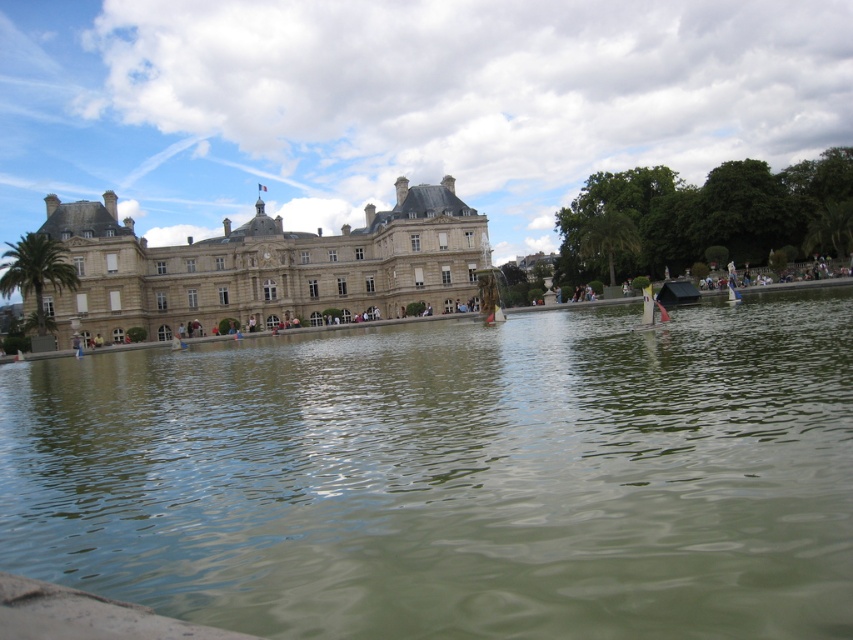
Question: Is greenish water at center further to the viewer compared to brown stone palace at center?

Choices:
 (A) yes
 (B) no

Answer: (B)

Question: Is greenish water at center to the left of brown stone palace at center from the viewer's perspective?

Choices:
 (A) yes
 (B) no

Answer: (B)

Question: Is greenish water at center bigger than brown stone palace at center?

Choices:
 (A) no
 (B) yes

Answer: (B)

Question: Which object appears farthest from the camera in this image?

Choices:
 (A) brown stone palace at center
 (B) greenish water at center

Answer: (A)

Question: Which object is farther from the camera taking this photo?

Choices:
 (A) greenish water at center
 (B) brown stone palace at center

Answer: (B)